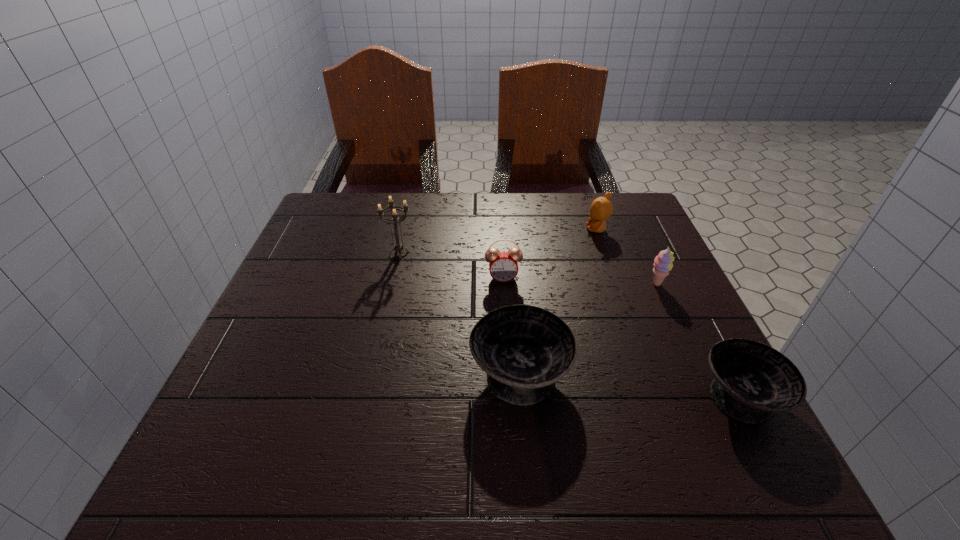
Find the location of a particular element. This screenshot has width=960, height=540. free spot between the left bowl and the right bowl is located at coordinates (631, 383).

Image resolution: width=960 pixels, height=540 pixels. What are the coordinates of `vacant region between the alarm clock and the second farthest object` in the screenshot? It's located at (451, 266).

Identify the location of unoccupied position between the sherbert and the alarm clock. (580, 281).

This screenshot has width=960, height=540. In order to click on free space between the alarm clock and the right bowl in this screenshot , I will do `click(622, 336)`.

What are the coordinates of `free space between the second farthest object and the alarm clock` in the screenshot? It's located at (451, 266).

You are a GUI agent. You are given a task and a screenshot of the screen. Output one action in this format:
    pyautogui.click(x=<x>, y=<y>)
    Task: Click on the vacant point located between the farthest object and the shortest object
    
    Given the screenshot: What is the action you would take?
    pyautogui.click(x=669, y=312)

The width and height of the screenshot is (960, 540). In order to click on free area in between the shorter bowl and the second farthest object in this screenshot , I will do `click(570, 325)`.

Locate an element on the screen. empty space that is in between the sherbert and the tallest object is located at coordinates (528, 269).

Locate an element on the screen. This screenshot has height=540, width=960. free spot between the right bowl and the second farthest object is located at coordinates (570, 325).

You are a GUI agent. You are given a task and a screenshot of the screen. Output one action in this format:
    pyautogui.click(x=<x>, y=<y>)
    Task: Click on the free space between the left bowl and the sherbert
    The height and width of the screenshot is (540, 960).
    Given the screenshot: What is the action you would take?
    pyautogui.click(x=588, y=328)